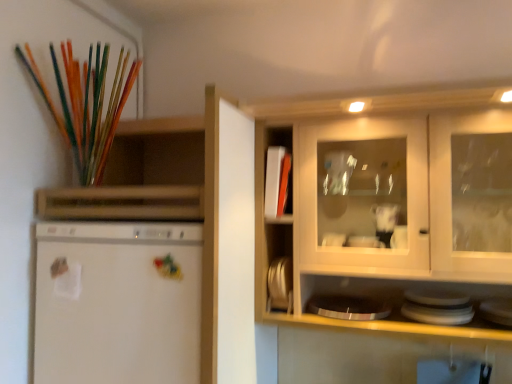
The height and width of the screenshot is (384, 512). What do you see at coordinates (278, 173) in the screenshot?
I see `white matte cabinet at center` at bounding box center [278, 173].

In order to face white glossy plate at lower right, acting as the second appliance starting from the left, should I rotate leftwards or rightwards?

Turn right by 31.681 degrees to look at white glossy plate at lower right, acting as the second appliance starting from the left.

This screenshot has height=384, width=512. Identify the location of translucent glass paint brush at upper left. (87, 104).

Locate an element on the screen. The width and height of the screenshot is (512, 384). white matte refrigerator at left is located at coordinates (118, 302).

From the image's perspective, is translucent glass paint brush at upper left above or below white glossy plate at lower right, acting as the second appliance starting from the left?

translucent glass paint brush at upper left is situated higher than white glossy plate at lower right, acting as the second appliance starting from the left, in the image.

Does translucent glass paint brush at upper left turn towards white glossy plate at lower right, placed as the 1th appliance when sorted from front to back?

No, translucent glass paint brush at upper left is not aimed at white glossy plate at lower right, placed as the 1th appliance when sorted from front to back.

Which is in front, point (75, 142) or point (496, 311)?

Positioned in front is point (496, 311).

From a real-world perspective, who is located higher, translucent glass paint brush at upper left or white glossy plate at lower right, acting as the second appliance starting from the left?

From a 3D spatial view, translucent glass paint brush at upper left is above.

Is white matte cabinet at center further to camera compared to white glossy plate at lower right, placed as the 1th appliance when sorted from front to back?

Yes, white matte cabinet at center is further from the viewer.

From a real-world perspective, between white matte cabinet at center and white glossy plate at lower right, acting as the second appliance starting from the left, who is vertically higher?

white matte cabinet at center, from a real-world perspective.

Is point (290, 184) less distant than point (507, 313)?

No, (290, 184) is behind (507, 313).

Would you say translucent glass paint brush at upper left contains white matte refrigerator at left?

That's incorrect, white matte refrigerator at left is not inside translucent glass paint brush at upper left.

I want to click on paint brush above the white matte refrigerator at left (from the image's perspective), so click(x=87, y=104).

Is translucent glass paint brush at upper left taller or shorter than white matte refrigerator at left?

Clearly, translucent glass paint brush at upper left is shorter compared to white matte refrigerator at left.

Measure the distance between translucent glass paint brush at upper left and white matte refrigerator at left.

translucent glass paint brush at upper left and white matte refrigerator at left are 47.40 centimeters apart from each other.

Could you measure the distance between white glossy plate at lower right, which is the second appliance from back to front, and metallic silver plates at center, the first appliance when ordered from back to front?

They are 25.16 inches apart.

Considering the relative sizes of white glossy plate at lower right, placed as the 1th appliance when sorted from front to back, and metallic silver plates at center, the first appliance when ordered from back to front, in the image provided, is white glossy plate at lower right, placed as the 1th appliance when sorted from front to back, smaller than metallic silver plates at center, the first appliance when ordered from back to front,?

No.

From the image's perspective, is white glossy plate at lower right, positioned as the first appliance in right-to-left order, located above metallic silver plates at center, the first appliance when ordered from back to front?

Incorrect, from the image's perspective, white glossy plate at lower right, positioned as the first appliance in right-to-left order, is lower than metallic silver plates at center, the first appliance when ordered from back to front.

Is white glossy plate at lower right, acting as the second appliance starting from the left, in front of metallic silver plates at center, positioned as the first appliance in left-to-right order?

Yes, white glossy plate at lower right, acting as the second appliance starting from the left, is closer to the camera.

Choose the correct answer: Is white glossy plate at lower right, acting as the second appliance starting from the left, inside white matte refrigerator at left or outside it?

white glossy plate at lower right, acting as the second appliance starting from the left, is not inside white matte refrigerator at left, it's outside.

Based on their sizes in the image, would you say white glossy plate at lower right, positioned as the first appliance in right-to-left order, is bigger or smaller than white matte refrigerator at left?

Clearly, white glossy plate at lower right, positioned as the first appliance in right-to-left order, is smaller in size than white matte refrigerator at left.

Where is `the 2nd appliance counting from the right side of the white matte refrigerator at left`? the 2nd appliance counting from the right side of the white matte refrigerator at left is located at coordinates (497, 311).

In the image, is white matte refrigerator at left positioned in front of or behind white matte cabinet at center?

white matte refrigerator at left is positioned closer to the viewer than white matte cabinet at center.

Can you confirm if white matte refrigerator at left is smaller than white matte cabinet at center?

Actually, white matte refrigerator at left might be larger than white matte cabinet at center.

Is white matte refrigerator at left positioned far away from white matte cabinet at center?

They are positioned close to each other.

Visually, is white matte refrigerator at left positioned to the left or to the right of white matte cabinet at center?

In the image, white matte refrigerator at left appears on the left side of white matte cabinet at center.

From a real-world perspective, is translucent glass paint brush at upper left beneath white matte cabinet at center?

No, from a real-world perspective, translucent glass paint brush at upper left is not below white matte cabinet at center.

How many degrees apart are the facing directions of translucent glass paint brush at upper left and white matte cabinet at center?

The angular difference between translucent glass paint brush at upper left and white matte cabinet at center is 0.524 degrees.

Is white matte cabinet at center at the back of translucent glass paint brush at upper left?

translucent glass paint brush at upper left does not have its back to white matte cabinet at center.

You are a GUI agent. You are given a task and a screenshot of the screen. Output one action in this format:
    pyautogui.click(x=<x>, y=<y>)
    Task: Click on the paint brush lying in front of the white matte cabinet at center
    
    Given the screenshot: What is the action you would take?
    pyautogui.click(x=87, y=104)

Find the location of a particular element. This screenshot has height=384, width=512. paint brush on the left of white glossy plate at lower right, positioned as the first appliance in right-to-left order is located at coordinates (87, 104).

The height and width of the screenshot is (384, 512). Find the location of `appliance on the right of white matte cabinet at center`. appliance on the right of white matte cabinet at center is located at coordinates (497, 311).

From the picture: When comparing their distances from metallic silver plates at center, positioned as the first appliance in left-to-right order, does translucent glass paint brush at upper left or white glossy plate at lower right, placed as the 1th appliance when sorted from front to back, seem further?

Among the two, translucent glass paint brush at upper left is located further to metallic silver plates at center, positioned as the first appliance in left-to-right order.

Considering their positions, is metallic silver plates at center, the second appliance in the right-to-left sequence, positioned closer to translucent glass paint brush at upper left than white glossy plate at lower right, positioned as the first appliance in right-to-left order?

The object closer to translucent glass paint brush at upper left is metallic silver plates at center, the second appliance in the right-to-left sequence.

When comparing their distances from white matte cabinet at center, does translucent glass paint brush at upper left or white matte refrigerator at left seem further?

Based on the image, translucent glass paint brush at upper left appears to be further to white matte cabinet at center.

From the image, which object appears to be nearer to white matte cabinet at center, white glossy plate at lower right, which is the second appliance from back to front, or white matte refrigerator at left?

Based on the image, white matte refrigerator at left appears to be nearer to white matte cabinet at center.

Estimate the real-world distances between objects in this image. Which object is further from white matte refrigerator at left, white glossy plate at lower right, which is the second appliance from back to front, or translucent glass paint brush at upper left?

white glossy plate at lower right, which is the second appliance from back to front, is positioned further to the anchor white matte refrigerator at left.

In the scene shown: Looking at the image, which one is located further to metallic silver plates at center, the second appliance in the right-to-left sequence, white matte refrigerator at left or white glossy plate at lower right, which is the second appliance from back to front?

Based on the image, white glossy plate at lower right, which is the second appliance from back to front, appears to be further to metallic silver plates at center, the second appliance in the right-to-left sequence.

From the image, which object appears to be nearer to white matte refrigerator at left, white glossy plate at lower right, which is the second appliance from back to front, or white matte cabinet at center?

Among the two, white matte cabinet at center is located nearer to white matte refrigerator at left.

Considering their positions, is translucent glass paint brush at upper left positioned closer to metallic silver plates at center, the second appliance in the right-to-left sequence, than white matte cabinet at center?

white matte cabinet at center lies closer to metallic silver plates at center, the second appliance in the right-to-left sequence, than the other object.

At what (x,y) coordinates should I click in order to perform the action: click on cabinet between translucent glass paint brush at upper left and white glossy plate at lower right, positioned as the first appliance in right-to-left order, from left to right. Please return your answer as a coordinate pair (x, y). The width and height of the screenshot is (512, 384). Looking at the image, I should click on (278, 173).

The width and height of the screenshot is (512, 384). I want to click on cabinet between metallic silver plates at center, the second appliance in the front-to-back sequence, and white glossy plate at lower right, acting as the second appliance starting from the left, so click(278, 173).

Find the location of a particular element. cabinet between white matte refrigerator at left and white glossy plate at lower right, which is the second appliance from back to front is located at coordinates (278, 173).

Locate an element on the screen. The image size is (512, 384). appliance between translucent glass paint brush at upper left and white glossy plate at lower right, placed as the 1th appliance when sorted from front to back, from left to right is located at coordinates (280, 285).